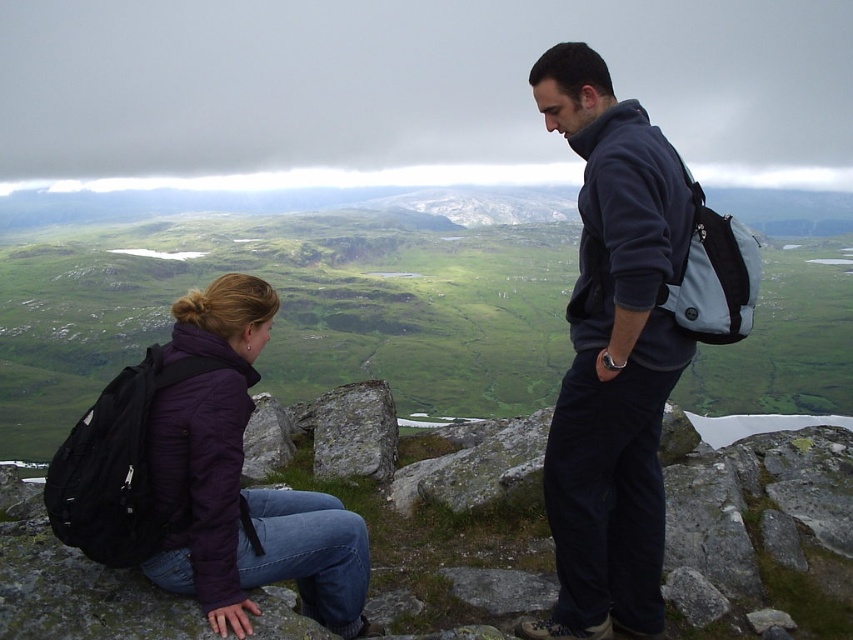
Question: Which point is closer to the camera?

Choices:
 (A) dark blue fleece jacket at center
 (B) purple matte jacket at lower left

Answer: (B)

Question: Does dark blue fleece jacket at center appear under purple matte jacket at lower left?

Choices:
 (A) yes
 (B) no

Answer: (B)

Question: Is dark blue fleece jacket at center wider than purple matte jacket at lower left?

Choices:
 (A) yes
 (B) no

Answer: (B)

Question: From the image, what is the correct spatial relationship of dark blue fleece jacket at center in relation to purple matte jacket at lower left?

Choices:
 (A) above
 (B) below

Answer: (A)

Question: Which of these objects is positioned closest to the gray rough rock at center?

Choices:
 (A) dark blue fleece jacket at center
 (B) purple matte jacket at lower left

Answer: (B)

Question: Estimate the real-world distances between objects in this image. Which object is farther from the gray rough rock at center?

Choices:
 (A) purple matte jacket at lower left
 (B) dark blue fleece jacket at center

Answer: (B)